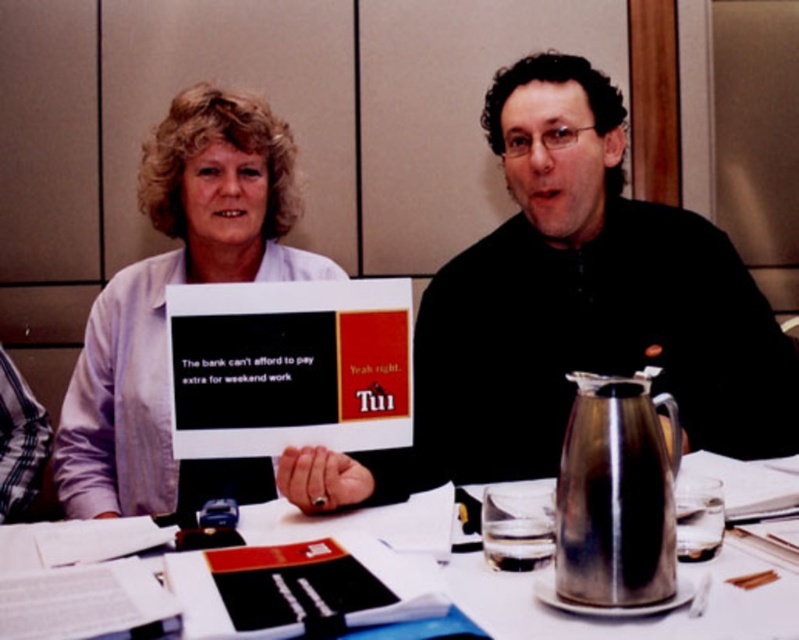
Is black matte sign at center to the right of matte white shirt at center from the viewer's perspective?

Yes, black matte sign at center is to the right of matte white shirt at center.

Is black matte sign at center closer to the viewer compared to matte white shirt at center?

Yes, it is in front of matte white shirt at center.

What do you see at coordinates (570, 308) in the screenshot? This screenshot has width=799, height=640. I see `black matte sign at center` at bounding box center [570, 308].

At what (x,y) coordinates should I click in order to perform the action: click on black matte sign at center. Please return your answer as a coordinate pair (x, y). The width and height of the screenshot is (799, 640). Looking at the image, I should click on (570, 308).

Which is in front, point (109, 300) or point (722, 568)?

Point (722, 568) is more forward.

Does point (285, 138) lie in front of point (495, 595)?

No, (285, 138) is further to viewer.

This screenshot has width=799, height=640. I want to click on matte white shirt at center, so click(x=171, y=284).

Does black matte sign at center have a lesser width compared to white paper at center?

Yes.

Is black matte sign at center further to the viewer compared to white paper at center?

Yes, it is.

I want to click on black matte sign at center, so click(x=570, y=308).